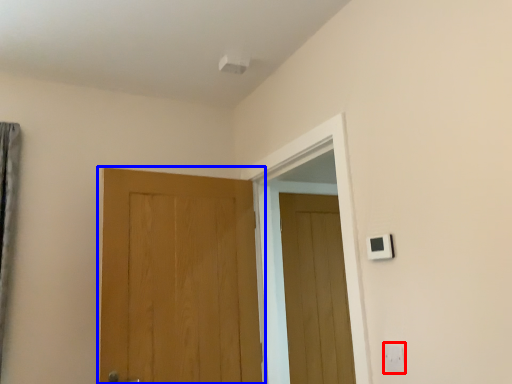
Question: Which object is closer to the camera taking this photo, electric outlet (highlighted by a red box) or door (highlighted by a blue box)?

Choices:
 (A) electric outlet
 (B) door

Answer: (A)